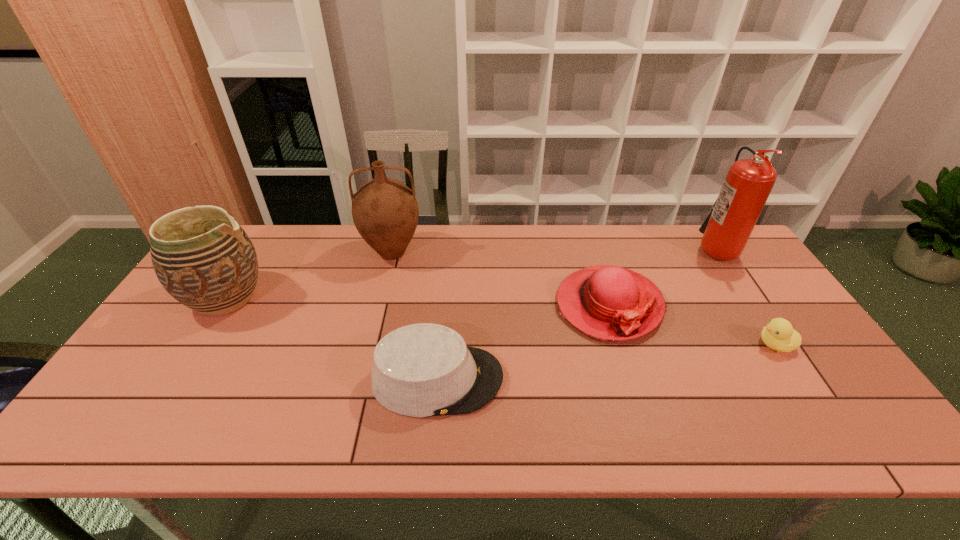
This screenshot has width=960, height=540. I want to click on object at the left edge, so click(x=206, y=261).

What are the coordinates of `fire extinguisher at the right edge` in the screenshot? It's located at (748, 184).

The image size is (960, 540). I want to click on duckling at the right edge, so click(x=779, y=335).

Find the location of a particular element. object that is at the far right corner is located at coordinates (748, 184).

You are a GUI agent. You are given a task and a screenshot of the screen. Output one action in this format:
    pyautogui.click(x=<x>, y=<y>)
    Task: Click on the vacant space at the far edge of the desktop
    The image size is (960, 540).
    Given the screenshot: What is the action you would take?
    pyautogui.click(x=696, y=267)

In the image, there is a desktop. Identify the location of vacant space at the near edge. The width and height of the screenshot is (960, 540). (298, 424).

The image size is (960, 540). In the image, there is a desktop. What are the coordinates of `free space at the left edge` in the screenshot? It's located at (120, 395).

I want to click on vacant space at the right edge of the desktop, so click(x=768, y=290).

The image size is (960, 540). Identify the location of empty space that is in between the duckling and the pottery. (501, 321).

Locate an element on the screen. vacant space in between the fourth object from left to right and the pottery is located at coordinates (418, 301).